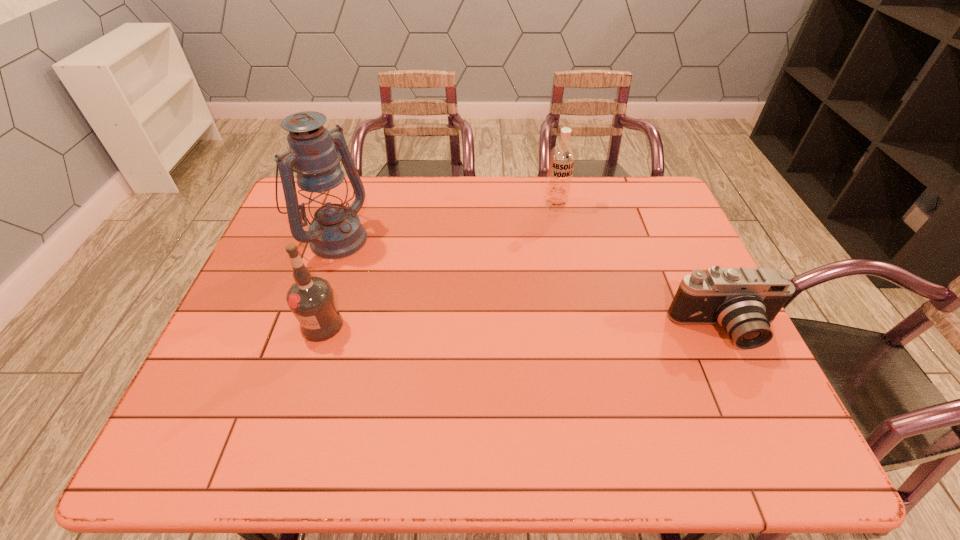
Where is `vacant space on the desktop that is between the left vodka and the rightmost object and is positioned on the front-facing side of the third nearest object`? This screenshot has width=960, height=540. vacant space on the desktop that is between the left vodka and the rightmost object and is positioned on the front-facing side of the third nearest object is located at coordinates (483, 327).

Locate an element on the screen. vacant space on the desktop that is between the left vodka and the camera and is positioned on the front label of the farther vodka is located at coordinates (542, 328).